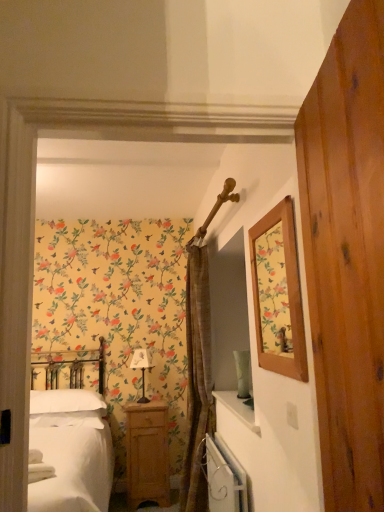
Question: Considering the relative sizes of white soft pillow at lower left and white fabric-covered lampshade at center in the image provided, is white soft pillow at lower left taller than white fabric-covered lampshade at center?

Choices:
 (A) no
 (B) yes

Answer: (A)

Question: From a real-world perspective, is white soft pillow at lower left positioned under white fabric-covered lampshade at center based on gravity?

Choices:
 (A) yes
 (B) no

Answer: (A)

Question: Is white soft pillow at lower left positioned beyond the bounds of white fabric-covered lampshade at center?

Choices:
 (A) no
 (B) yes

Answer: (B)

Question: Is the surface of white soft pillow at lower left in direct contact with white fabric-covered lampshade at center?

Choices:
 (A) yes
 (B) no

Answer: (B)

Question: Does white soft pillow at lower left have a smaller size compared to white fabric-covered lampshade at center?

Choices:
 (A) yes
 (B) no

Answer: (B)

Question: Considering the relative positions of white fabric-covered lampshade at center and white metallic radiator at lower center in the image provided, is white fabric-covered lampshade at center to the left or to the right of white metallic radiator at lower center?

Choices:
 (A) right
 (B) left

Answer: (B)

Question: From a real-world perspective, is white fabric-covered lampshade at center positioned above or below white metallic radiator at lower center?

Choices:
 (A) below
 (B) above

Answer: (B)

Question: Is white fabric-covered lampshade at center bigger or smaller than white metallic radiator at lower center?

Choices:
 (A) big
 (B) small

Answer: (B)

Question: Would you say white fabric-covered lampshade at center is inside or outside white metallic radiator at lower center?

Choices:
 (A) outside
 (B) inside

Answer: (A)

Question: Considering the positions of point (203, 292) and point (82, 396), is point (203, 292) closer or farther from the camera than point (82, 396)?

Choices:
 (A) closer
 (B) farther

Answer: (A)

Question: Is brown textured curtain at center inside the boundaries of white soft pillow at lower left, or outside?

Choices:
 (A) inside
 (B) outside

Answer: (B)

Question: Is brown textured curtain at center wider or thinner than white soft pillow at lower left?

Choices:
 (A) thin
 (B) wide

Answer: (A)

Question: Considering their positions, is brown textured curtain at center located in front of or behind white soft pillow at lower left?

Choices:
 (A) front
 (B) behind

Answer: (A)

Question: In terms of size, does light wood/texture nightstand at lower center appear bigger or smaller than wooden picture frame at upper right?

Choices:
 (A) small
 (B) big

Answer: (B)

Question: Is light wood/texture nightstand at lower center taller or shorter than wooden picture frame at upper right?

Choices:
 (A) tall
 (B) short

Answer: (A)